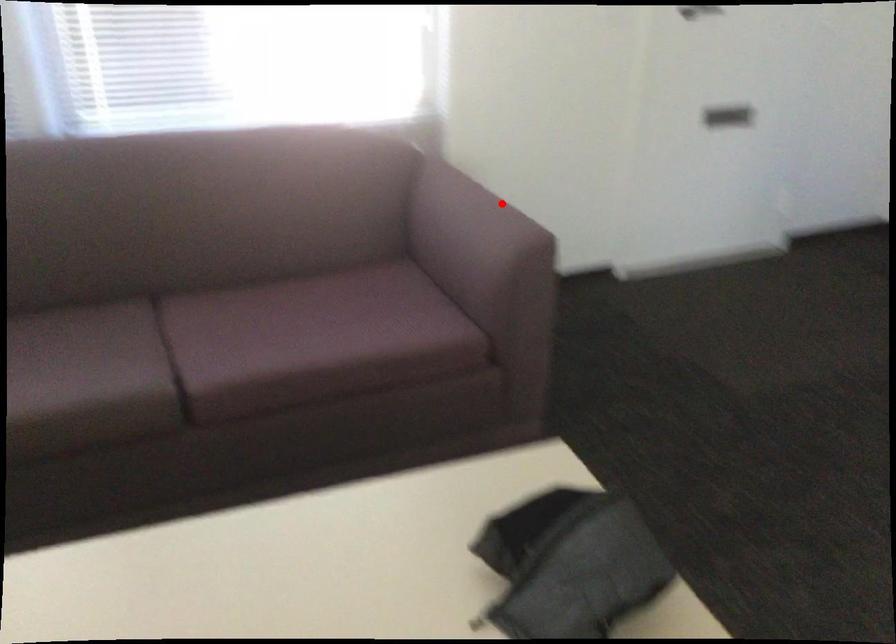
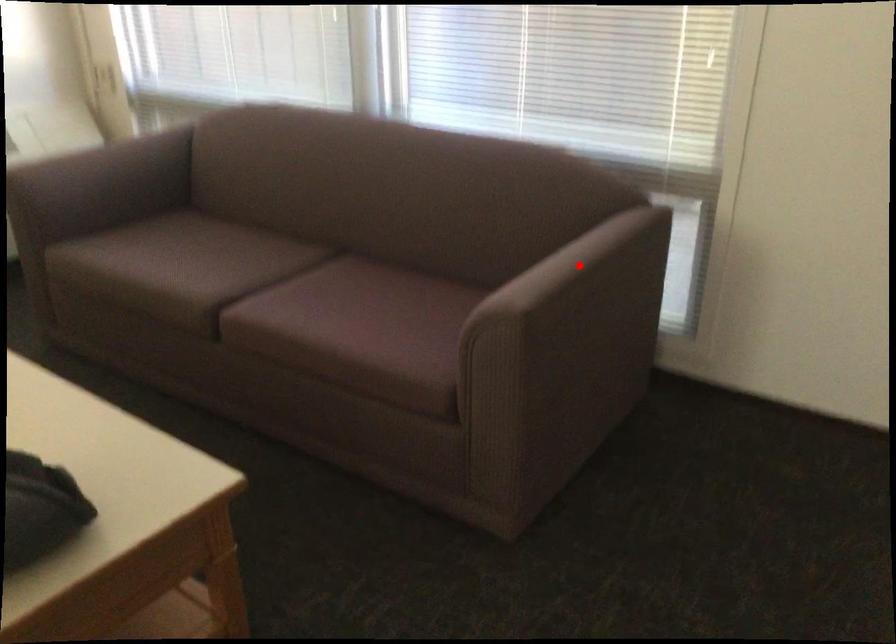
I am providing you with two images of the same scene from different viewpoints. A red point is marked on the first image and another point is marked on the second image. Are the points marked in image1 and image2 representing the same 3D position?

Yes